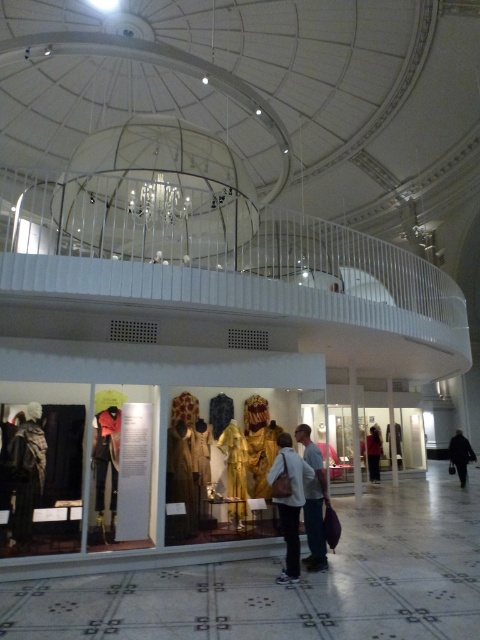
Between dark brown leather jacket at lower left and gold textured fabric at center, which one is positioned lower?

gold textured fabric at center

Does dark brown leather jacket at lower left appear on the right side of gold textured fabric at center?

Result: Incorrect, dark brown leather jacket at lower left is not on the right side of gold textured fabric at center.

The height and width of the screenshot is (640, 480). I want to click on dark brown leather jacket at lower left, so click(23, 470).

Between white cotton shirt at center and dark brown leather jacket at center, which one is positioned lower?

dark brown leather jacket at center

Between point (324, 541) and point (379, 442), which one is positioned behind?

Point (379, 442)

Where is `white cotton shirt at center`? white cotton shirt at center is located at coordinates [313, 500].

Is matte gold dress at center thinner than gold textured fabric at center?

No.

Is the position of matte gold dress at center more distant than that of gold textured fabric at center?

No, matte gold dress at center is in front of gold textured fabric at center.

Between point (296, 573) and point (239, 483), which one is positioned in front?

Point (296, 573) is more forward.

At what (x,y) coordinates should I click in order to perform the action: click on matte gold dress at center. Please return your answer as a coordinate pair (x, y). The height and width of the screenshot is (640, 480). Looking at the image, I should click on (289, 500).